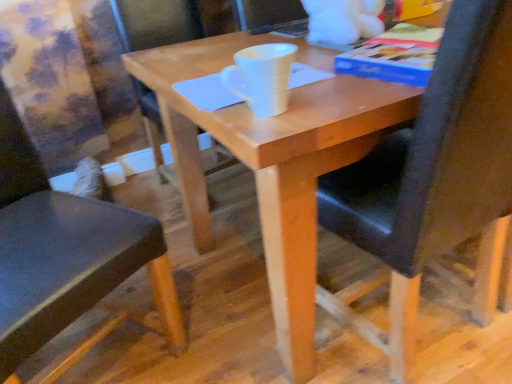
Question: Is black leather chair at center, acting as the 2th chair starting from the left, in front of blue paper at upper right?

Choices:
 (A) no
 (B) yes

Answer: (B)

Question: Is black leather chair at center, acting as the 2th chair starting from the left, not close to blue paper at upper right?

Choices:
 (A) yes
 (B) no

Answer: (B)

Question: From a real-world perspective, is black leather chair at center, acting as the first chair starting from the right, beneath blue paper at upper right?

Choices:
 (A) no
 (B) yes

Answer: (B)

Question: Is black leather chair at center, acting as the first chair starting from the right, touching blue paper at upper right?

Choices:
 (A) yes
 (B) no

Answer: (B)

Question: Is black leather chair at center, acting as the first chair starting from the right, shorter than blue paper at upper right?

Choices:
 (A) yes
 (B) no

Answer: (B)

Question: Considering their positions, is blue paper at upper right located in front of or behind black leather chair at center, acting as the 2th chair starting from the left?

Choices:
 (A) behind
 (B) front

Answer: (A)

Question: In terms of width, does blue paper at upper right look wider or thinner when compared to black leather chair at center, acting as the first chair starting from the right?

Choices:
 (A) wide
 (B) thin

Answer: (B)

Question: Is point pos(407,76) closer or farther from the camera than point pos(443,33)?

Choices:
 (A) farther
 (B) closer

Answer: (A)

Question: From a real-world perspective, is blue paper at upper right positioned above or below black leather chair at center, acting as the 2th chair starting from the left?

Choices:
 (A) above
 (B) below

Answer: (A)

Question: From a real-world perspective, relative to white matte mug at center, is black leather chair at center, acting as the first chair starting from the right, vertically above or below?

Choices:
 (A) above
 (B) below

Answer: (B)

Question: In terms of width, does black leather chair at center, acting as the first chair starting from the right, look wider or thinner when compared to white matte mug at center?

Choices:
 (A) thin
 (B) wide

Answer: (B)

Question: From the image's perspective, is black leather chair at center, acting as the 2th chair starting from the left, above or below white matte mug at center?

Choices:
 (A) above
 (B) below

Answer: (B)

Question: Would you say black leather chair at center, acting as the first chair starting from the right, is to the left or to the right of white matte mug at center in the picture?

Choices:
 (A) right
 (B) left

Answer: (A)

Question: In terms of size, does white matte mug at center appear bigger or smaller than black leather chair at center, acting as the first chair starting from the right?

Choices:
 (A) big
 (B) small

Answer: (B)

Question: From the image's perspective, relative to black leather chair at center, acting as the 2th chair starting from the left, is white matte mug at center above or below?

Choices:
 (A) above
 (B) below

Answer: (A)